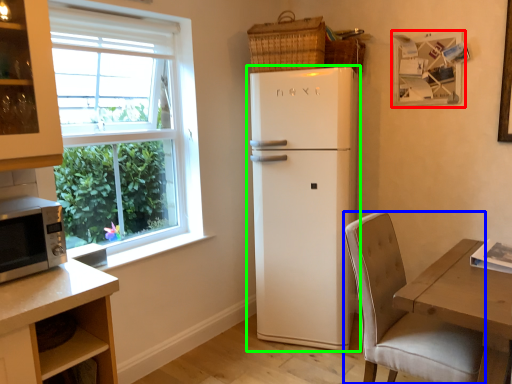
Question: Which object is positioned farthest from picture frame (highlighted by a red box)? Select from chair (highlighted by a blue box) and refrigerator (highlighted by a green box).

Choices:
 (A) chair
 (B) refrigerator

Answer: (A)